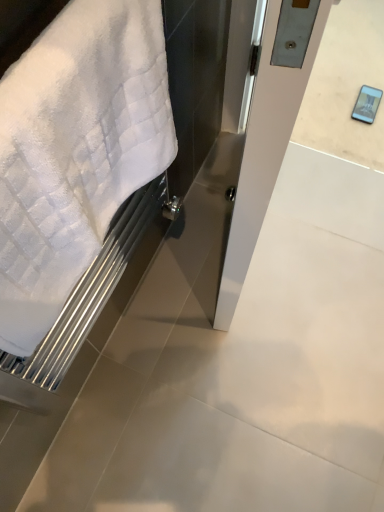
At what (x,y) coordinates should I click in order to perform the action: click on free spot below white soft towel at left (from a real-world perspective). Please return your answer as a coordinate pair (x, y). Looking at the image, I should click on (147, 333).